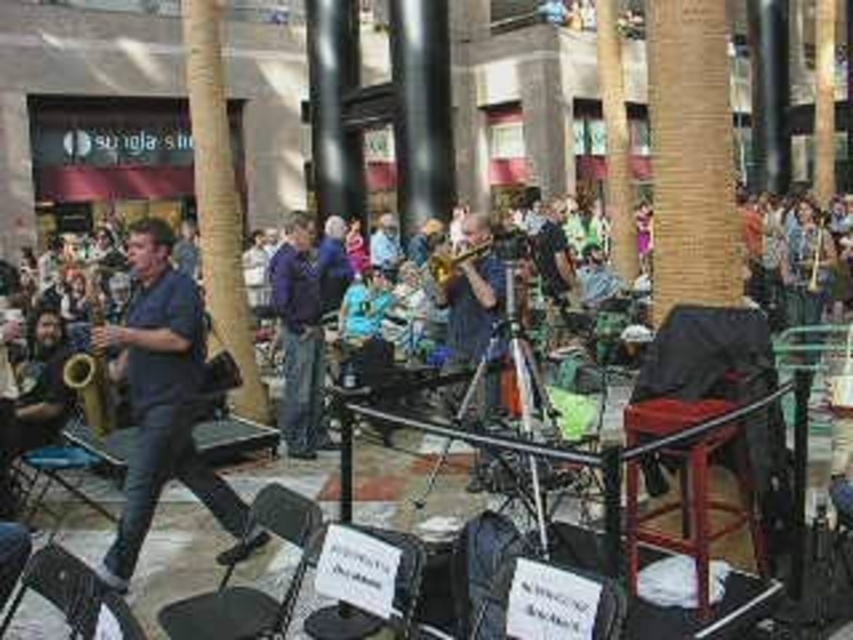
Is wooden chair at center bigger than metallic black chair at lower left?

Yes.

Who is higher up, wooden chair at center or metallic black chair at lower left?

wooden chair at center is above.

Between point (772, 442) and point (204, 598), which one is positioned in front?

Positioned in front is point (204, 598).

You are a GUI agent. You are given a task and a screenshot of the screen. Output one action in this format:
    pyautogui.click(x=<x>, y=<y>)
    Task: Click on the wooden chair at center
    The image size is (853, 640).
    Given the screenshot: What is the action you would take?
    pyautogui.click(x=708, y=355)

Is black plastic chair at lower left taller than black leather chair at center?

Indeed, black plastic chair at lower left has a greater height compared to black leather chair at center.

Does black plastic chair at lower left appear on the left side of black leather chair at center?

Indeed, black plastic chair at lower left is positioned on the left side of black leather chair at center.

Image resolution: width=853 pixels, height=640 pixels. I want to click on black plastic chair at lower left, so click(73, 595).

Does wooden chair at center have a greater width compared to black plastic chair at lower left?

No, wooden chair at center is not wider than black plastic chair at lower left.

Can you confirm if wooden chair at center is bigger than black plastic chair at lower left?

No, wooden chair at center is not bigger than black plastic chair at lower left.

Between point (683, 372) and point (91, 602), which one is positioned in front?

Point (91, 602)

In order to click on wooden chair at center in this screenshot , I will do [x=708, y=355].